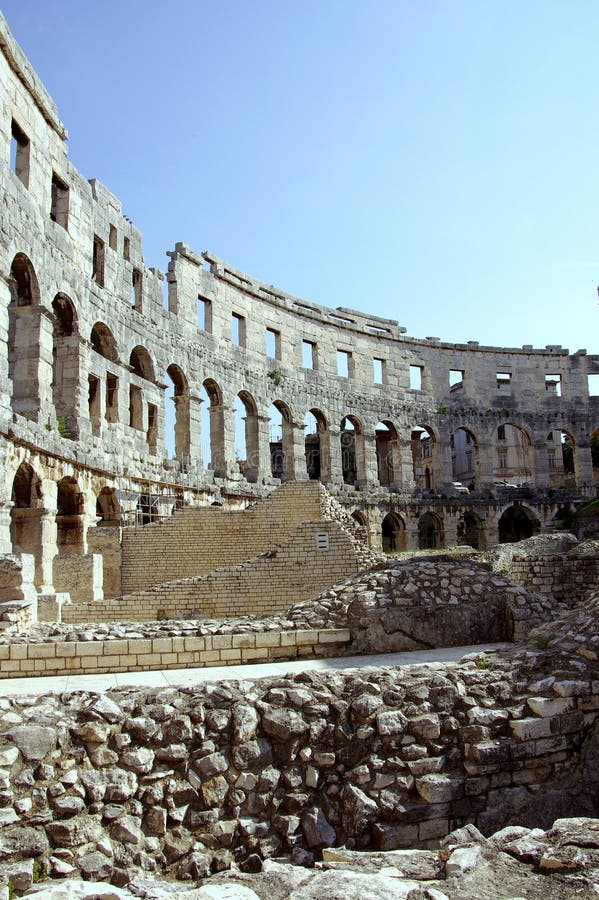
Locate an element on the screen. The height and width of the screenshot is (900, 599). vent is located at coordinates (322, 541).